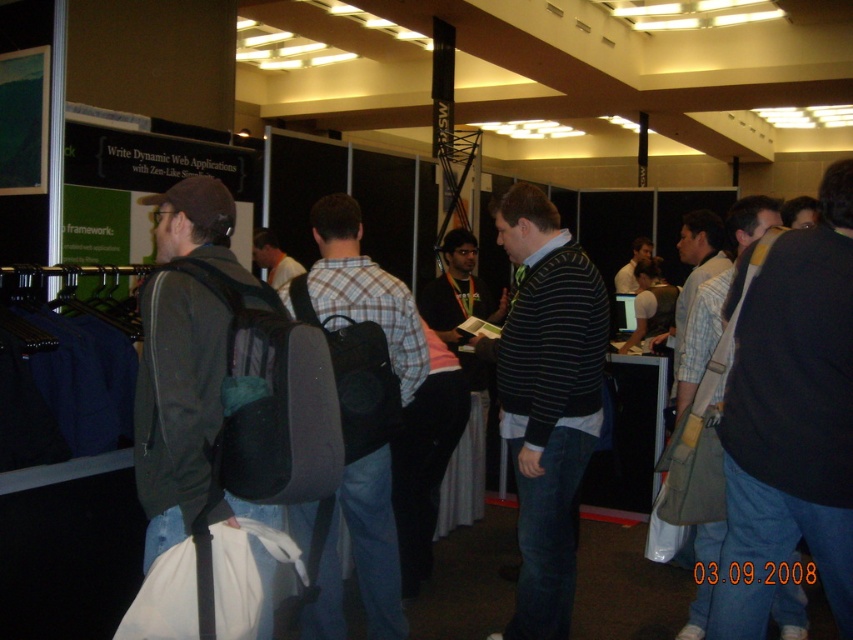
You are standing at the entrance of the event space and want to locate the person wearing the plaid fabric shirt at center. According to the coordinates provided, in which direction should you look to find them?

The plaid fabric shirt at center is located at coordinates point (360, 412), which is to the right and slightly forward from your position at the entrance.